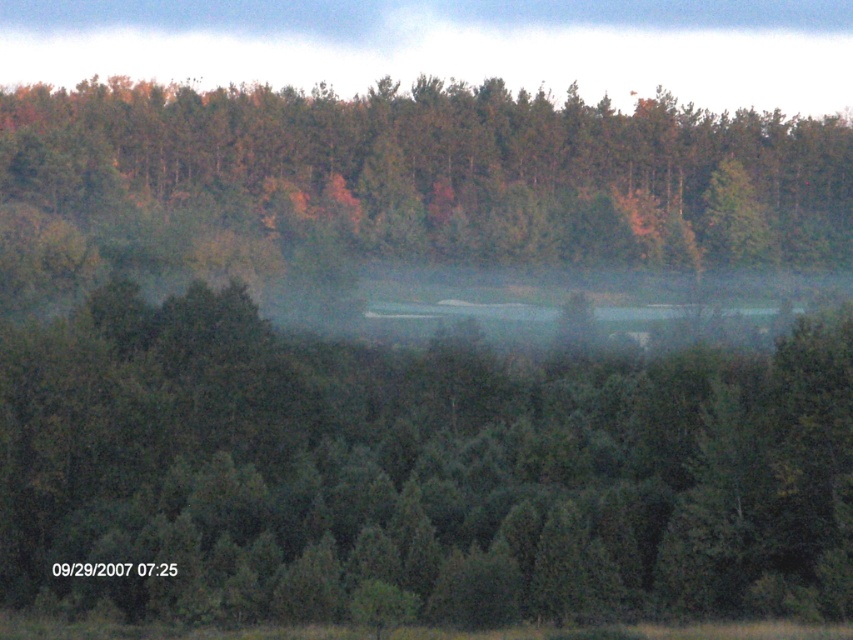
Question: Which object appears closest to the camera in this image?

Choices:
 (A) foggy mist at upper center
 (B) green matte tree at center
 (C) green matte trees at upper center

Answer: (B)

Question: Among these points, which one is farthest from the camera?

Choices:
 (A) click(x=541, y=147)
 (B) click(x=512, y=428)
 (C) click(x=38, y=0)

Answer: (C)

Question: Can you confirm if green matte trees at upper center is positioned to the right of foggy mist at upper center?

Choices:
 (A) no
 (B) yes

Answer: (B)

Question: Can you confirm if green matte tree at center is bigger than green matte trees at upper center?

Choices:
 (A) no
 (B) yes

Answer: (A)

Question: From the image, what is the correct spatial relationship of green matte tree at center in relation to green matte trees at upper center?

Choices:
 (A) right
 (B) left

Answer: (B)

Question: Which point appears farthest from the camera in this image?

Choices:
 (A) click(553, 502)
 (B) click(549, 1)
 (C) click(819, 196)

Answer: (B)